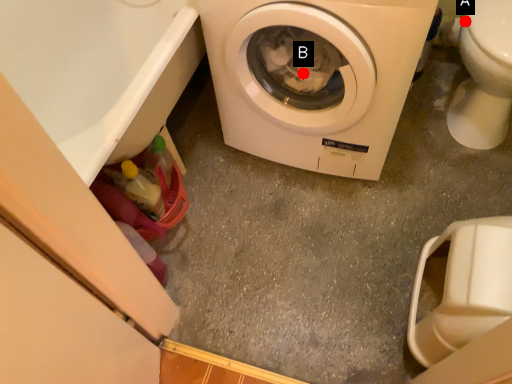
Question: Two points are circled on the image, labeled by A and B beside each circle. Which point is farther to the camera?

Choices:
 (A) A is further
 (B) B is further

Answer: (A)